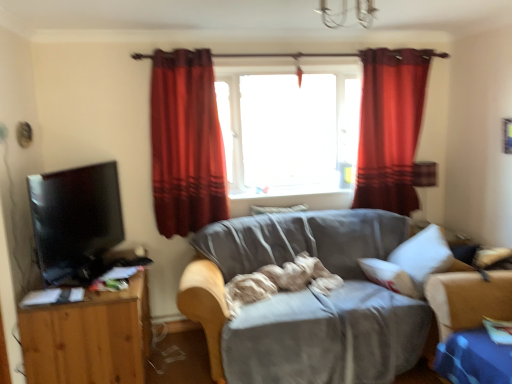
The height and width of the screenshot is (384, 512). What do you see at coordinates (75, 221) in the screenshot?
I see `matte black tv at left` at bounding box center [75, 221].

Find the location of `matte black tv at left`. matte black tv at left is located at coordinates (75, 221).

How much space does red velvet curtain at upper center, placed as the 1th curtain when sorted from right to left, occupy vertically?

red velvet curtain at upper center, placed as the 1th curtain when sorted from right to left, is 1.44 meters in height.

Where is `gray fabric couch at center`? The width and height of the screenshot is (512, 384). gray fabric couch at center is located at coordinates (304, 300).

Where is `wooden tv stand at left`? This screenshot has width=512, height=384. wooden tv stand at left is located at coordinates (89, 338).

Identify the location of matte black tv at left. (75, 221).

From a real-world perspective, is wooden tv stand at left above or below transparent glass window at center?

From a real-world perspective, wooden tv stand at left is physically below transparent glass window at center.

Does wooden tv stand at left have a lesser height compared to transparent glass window at center?

Yes, wooden tv stand at left is shorter than transparent glass window at center.

Is wooden tv stand at left positioned beyond the bounds of transparent glass window at center?

Absolutely, wooden tv stand at left is external to transparent glass window at center.

Would you say velvet red curtain at center, which is the 1th curtain from left to right, contains wooden tv stand at left?

Actually, wooden tv stand at left is outside velvet red curtain at center, which is the 1th curtain from left to right.

Starting from the wooden tv stand at left, which curtain is the 1st one behind? Please provide its 2D coordinates.

[(186, 143)]

Is velvet red curtain at center, which appears as the 2th curtain when viewed from the right, in front of or behind wooden tv stand at left in the image?

velvet red curtain at center, which appears as the 2th curtain when viewed from the right, is positioned farther from the viewer than wooden tv stand at left.

Based on their sizes in the image, would you say velvet red curtain at center, which is the 1th curtain from left to right, is bigger or smaller than wooden tv stand at left?

Clearly, velvet red curtain at center, which is the 1th curtain from left to right, is smaller in size than wooden tv stand at left.

Between velvet red curtain at center, which appears as the 2th curtain when viewed from the right, and gray fabric couch at center, which one has less height?

Standing shorter between the two is gray fabric couch at center.

Considering the relative positions of velvet red curtain at center, which is the 1th curtain from left to right, and gray fabric couch at center in the image provided, is velvet red curtain at center, which is the 1th curtain from left to right, behind gray fabric couch at center?

Yes.

Is velvet red curtain at center, which is the 1th curtain from left to right, spatially inside gray fabric couch at center, or outside of it?

velvet red curtain at center, which is the 1th curtain from left to right, exists outside the volume of gray fabric couch at center.

From a real-world perspective, does velvet red curtain at center, which appears as the 2th curtain when viewed from the right, stand above gray fabric couch at center?

Yes, from a real-world perspective, velvet red curtain at center, which appears as the 2th curtain when viewed from the right, is over gray fabric couch at center

Is point (401, 160) more distant than point (25, 354)?

Yes, it is.

Which object is positioned more to the left, red velvet curtain at upper center, placed as the 1th curtain when sorted from right to left, or wooden tv stand at left?

From the viewer's perspective, wooden tv stand at left appears more on the left side.

Is red velvet curtain at upper center, placed as the 1th curtain when sorted from right to left, positioned with its back to wooden tv stand at left?

red velvet curtain at upper center, placed as the 1th curtain when sorted from right to left, is not turned away from wooden tv stand at left.

Is red velvet curtain at upper center, the 2th curtain viewed from the left, shorter than wooden tv stand at left?

In fact, red velvet curtain at upper center, the 2th curtain viewed from the left, may be taller than wooden tv stand at left.

Between gray fabric couch at center and velvet red curtain at center, which appears as the 2th curtain when viewed from the right, which one has less height?

With less height is gray fabric couch at center.

Is the surface of gray fabric couch at center in direct contact with velvet red curtain at center, which appears as the 2th curtain when viewed from the right?

No, gray fabric couch at center is not making contact with velvet red curtain at center, which appears as the 2th curtain when viewed from the right.

From the image's perspective, between gray fabric couch at center and velvet red curtain at center, which is the 1th curtain from left to right, who is located below?

gray fabric couch at center appears lower in the image.

Considering the relative positions of gray fabric couch at center and velvet red curtain at center, which appears as the 2th curtain when viewed from the right, in the image provided, is gray fabric couch at center to the left or to the right of velvet red curtain at center, which appears as the 2th curtain when viewed from the right,?

gray fabric couch at center is to the right of velvet red curtain at center, which appears as the 2th curtain when viewed from the right.

How many degrees apart are the facing directions of matte black tv at left and wooden tv stand at left?

The angular difference between matte black tv at left and wooden tv stand at left is 17.4 degrees.

Considering the relative positions of matte black tv at left and wooden tv stand at left in the image provided, is matte black tv at left to the left of wooden tv stand at left from the viewer's perspective?

Correct, you'll find matte black tv at left to the left of wooden tv stand at left.

From a real-world perspective, does matte black tv at left sit lower than wooden tv stand at left?

Incorrect, from a real-world perspective, matte black tv at left is higher than wooden tv stand at left.

Considering the positions of point (103, 198) and point (131, 288), is point (103, 198) closer or farther from the camera than point (131, 288)?

Point (103, 198).

From the image's perspective, is velvet red curtain at center, which appears as the 2th curtain when viewed from the right, below matte black tv at left?

Actually, velvet red curtain at center, which appears as the 2th curtain when viewed from the right, appears above matte black tv at left in the image.

Between velvet red curtain at center, which appears as the 2th curtain when viewed from the right, and matte black tv at left, which one appears on the left side from the viewer's perspective?

matte black tv at left is more to the left.

You are a GUI agent. You are given a task and a screenshot of the screen. Output one action in this format:
    pyautogui.click(x=<x>, y=<y>)
    Task: Click on the 1st curtain counting from the right side of the matte black tv at left
    This screenshot has height=384, width=512.
    Given the screenshot: What is the action you would take?
    pyautogui.click(x=186, y=143)

Find the location of `table lying on the left of transparent glass window at center`. table lying on the left of transparent glass window at center is located at coordinates (89, 338).

Identify the location of table below the velvet red curtain at center, which is the 1th curtain from left to right (from the image's perspective). The height and width of the screenshot is (384, 512). (89, 338).

Looking at the image, which one is located further to wooden tv stand at left, velvet red curtain at center, which appears as the 2th curtain when viewed from the right, or transparent glass window at center?

Based on the image, transparent glass window at center appears to be further to wooden tv stand at left.

Looking at the image, which one is located further to transparent glass window at center, red velvet curtain at upper center, placed as the 1th curtain when sorted from right to left, or gray fabric couch at center?

The object further to transparent glass window at center is gray fabric couch at center.

Based on their spatial positions, is gray fabric couch at center or velvet red curtain at center, which appears as the 2th curtain when viewed from the right, closer to matte black tv at left?

velvet red curtain at center, which appears as the 2th curtain when viewed from the right.

Based on their spatial positions, is velvet red curtain at center, which is the 1th curtain from left to right, or red velvet curtain at upper center, the 2th curtain viewed from the left, closer to wooden tv stand at left?

Based on the image, velvet red curtain at center, which is the 1th curtain from left to right, appears to be nearer to wooden tv stand at left.

Estimate the real-world distances between objects in this image. Which object is further from matte black tv at left, velvet red curtain at center, which is the 1th curtain from left to right, or wooden tv stand at left?

velvet red curtain at center, which is the 1th curtain from left to right, lies further to matte black tv at left than the other object.

Considering their positions, is red velvet curtain at upper center, placed as the 1th curtain when sorted from right to left, positioned further to matte black tv at left than wooden tv stand at left?

red velvet curtain at upper center, placed as the 1th curtain when sorted from right to left.

Considering their positions, is gray fabric couch at center positioned further to transparent glass window at center than velvet red curtain at center, which appears as the 2th curtain when viewed from the right?

gray fabric couch at center lies further to transparent glass window at center than the other object.

Which object lies nearer to the anchor point transparent glass window at center, matte black tv at left or wooden tv stand at left?

matte black tv at left is closer to transparent glass window at center.

This screenshot has height=384, width=512. What are the coordinates of `curtain between matte black tv at left and red velvet curtain at upper center, placed as the 1th curtain when sorted from right to left, in the horizontal direction` in the screenshot? It's located at (186, 143).

Locate an element on the screen. This screenshot has height=384, width=512. flat between velvet red curtain at center, which appears as the 2th curtain when viewed from the right, and wooden tv stand at left in the up-down direction is located at coordinates (75, 221).

The height and width of the screenshot is (384, 512). Identify the location of window between matte black tv at left and red velvet curtain at upper center, placed as the 1th curtain when sorted from right to left, in the horizontal direction. (289, 128).

Find the location of a particular element. The image size is (512, 384). window between velvet red curtain at center, which appears as the 2th curtain when viewed from the right, and red velvet curtain at upper center, the 2th curtain viewed from the left is located at coordinates (289, 128).